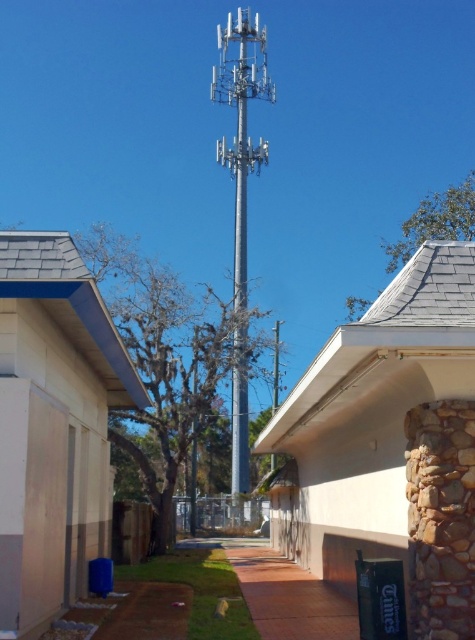
Question: Does silver metallic tower at center come behind silver metallic pole at center?

Choices:
 (A) no
 (B) yes

Answer: (B)

Question: Is silver metallic tower at center positioned behind silver metallic pole at center?

Choices:
 (A) yes
 (B) no

Answer: (A)

Question: Which of the following is the closest to the observer?

Choices:
 (A) silver metallic pole at center
 (B) silver metallic tower at center

Answer: (A)

Question: Does silver metallic tower at center have a smaller size compared to silver metallic pole at center?

Choices:
 (A) yes
 (B) no

Answer: (B)

Question: Which point is closer to the camera?

Choices:
 (A) silver metallic tower at center
 (B) silver metallic pole at center

Answer: (B)

Question: Among these objects, which one is nearest to the camera?

Choices:
 (A) silver metallic pole at center
 (B) silver metallic tower at center

Answer: (A)